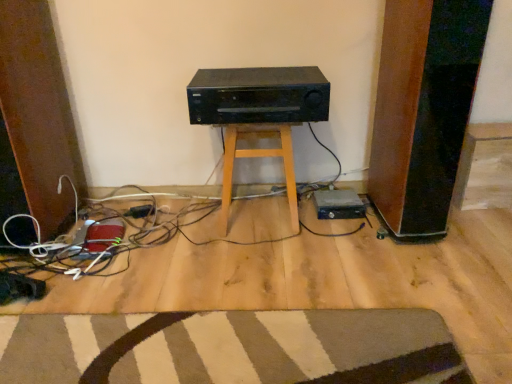
This screenshot has width=512, height=384. Find the location of `vacant space to the left of black plastic plug at lower center`. vacant space to the left of black plastic plug at lower center is located at coordinates (101, 213).